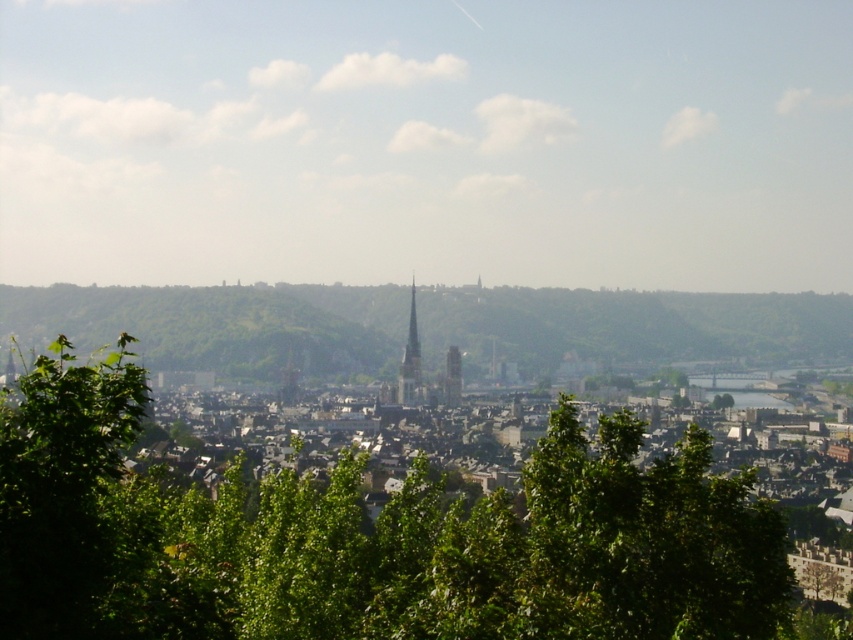
Is green leafy tree at center wider than smooth stone tower at center?

Yes.

Who is positioned more to the right, green leafy tree at center or smooth stone tower at center?

green leafy tree at center is more to the right.

The image size is (853, 640). I want to click on green leafy tree at center, so click(x=368, y=538).

Find the location of a particular element. green leafy tree at center is located at coordinates (368, 538).

In the scene shown: Is green leafy hill at center positioned at the back of smooth stone tower at center?

Yes, green leafy hill at center is behind smooth stone tower at center.

Between green leafy hill at center and smooth stone tower at center, which one is positioned lower?

smooth stone tower at center is lower down.

Between point (407, 301) and point (415, 330), which one is positioned behind?

Point (415, 330)

I want to click on green leafy hill at center, so click(x=221, y=324).

Is green leafy tree at center above green leafy hill at center?

No, green leafy tree at center is not above green leafy hill at center.

Identify the location of green leafy tree at center. This screenshot has width=853, height=640. (368, 538).

Locate an element on the screen. This screenshot has width=853, height=640. green leafy tree at center is located at coordinates (368, 538).